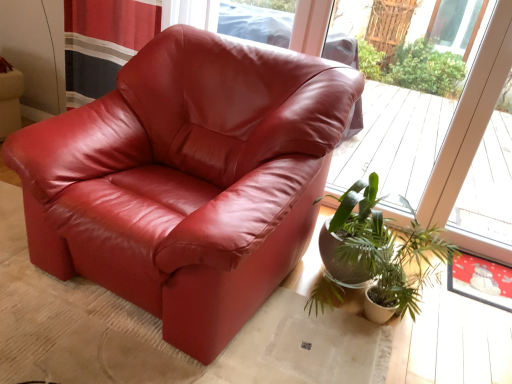
Question: Can you confirm if green leafy plant at lower right is bigger than matte leather armchair at center?

Choices:
 (A) no
 (B) yes

Answer: (A)

Question: Is green leafy plant at lower right outside matte leather armchair at center?

Choices:
 (A) no
 (B) yes

Answer: (B)

Question: From a real-world perspective, is green leafy plant at lower right beneath matte leather armchair at center?

Choices:
 (A) yes
 (B) no

Answer: (A)

Question: Is green leafy plant at lower right at the left side of matte leather armchair at center?

Choices:
 (A) no
 (B) yes

Answer: (A)

Question: From the image's perspective, would you say green leafy plant at lower right is shown under matte leather armchair at center?

Choices:
 (A) yes
 (B) no

Answer: (A)

Question: From a real-world perspective, does green leafy plant at lower right stand above matte leather armchair at center?

Choices:
 (A) yes
 (B) no

Answer: (B)

Question: Is green leafy plant at lower right completely or partially inside matte leather armchair at center?

Choices:
 (A) yes
 (B) no

Answer: (B)

Question: From the image's perspective, is matte leather armchair at center over green leafy plant at lower right?

Choices:
 (A) no
 (B) yes

Answer: (B)

Question: Does matte leather armchair at center have a greater height compared to green leafy plant at lower right?

Choices:
 (A) yes
 (B) no

Answer: (A)

Question: Is matte leather armchair at center next to green leafy plant at lower right?

Choices:
 (A) no
 (B) yes

Answer: (A)

Question: Considering the relative sizes of matte leather armchair at center and green leafy plant at lower right in the image provided, is matte leather armchair at center thinner than green leafy plant at lower right?

Choices:
 (A) yes
 (B) no

Answer: (B)

Question: Considering the relative positions of matte leather armchair at center and green leafy plant at lower right in the image provided, is matte leather armchair at center to the right of green leafy plant at lower right from the viewer's perspective?

Choices:
 (A) yes
 (B) no

Answer: (B)

Question: From the image's perspective, is green leafy plant at lower right on transparent glass window at upper center?

Choices:
 (A) yes
 (B) no

Answer: (B)